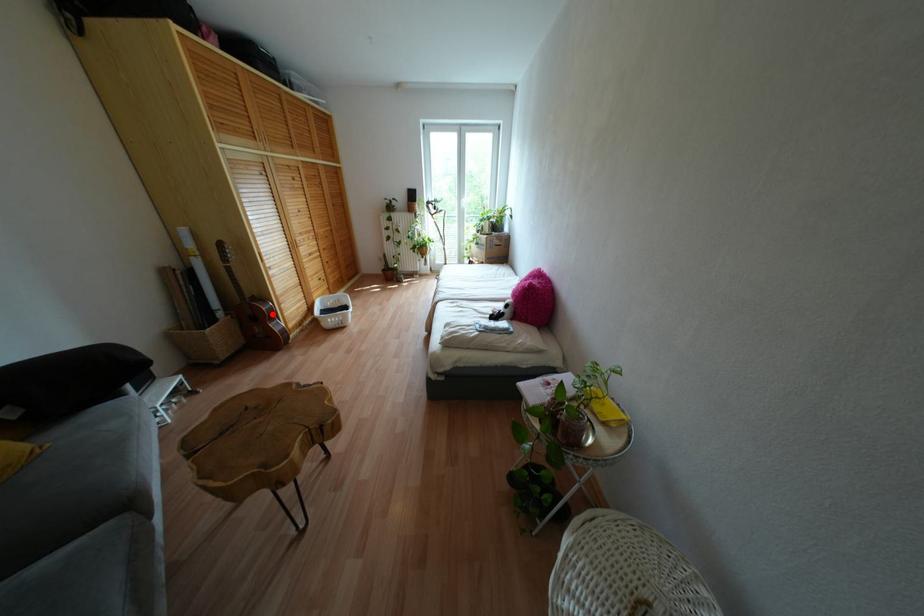
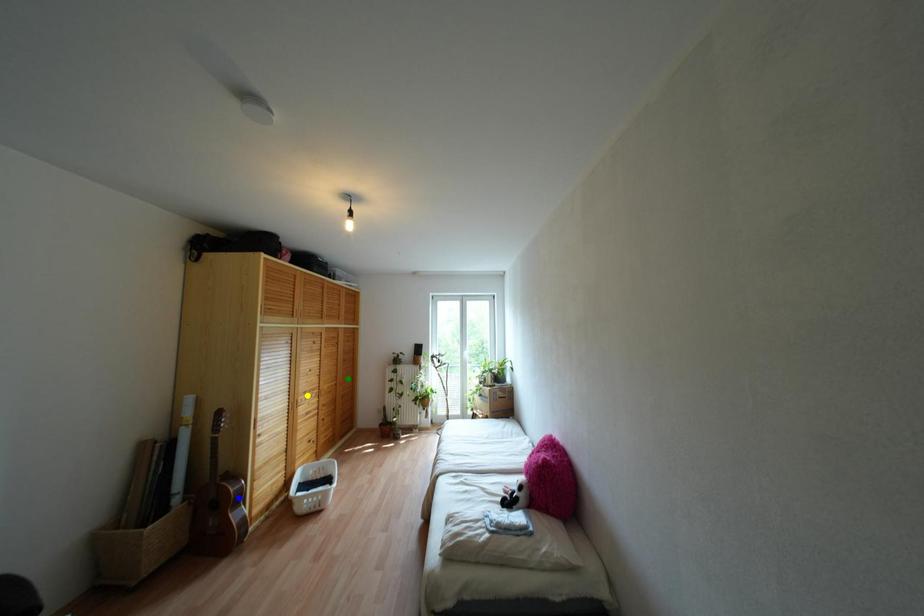
Question: I am providing you with two images of the same scene from different viewpoints. A red point is marked on the first image. You are given multiple points on the second image. Which mark in image 2 goes with the point in image 1?

Choices:
 (A) green point
 (B) yellow point
 (C) blue point

Answer: (C)